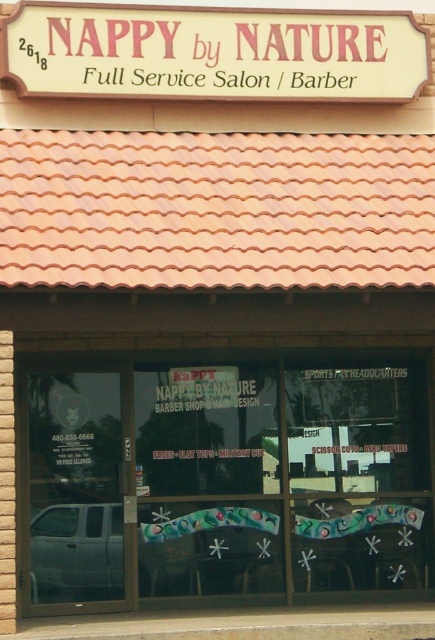
Does point (210, 529) come closer to viewer compared to point (101, 6)?

No, it is not.

What do you see at coordinates (236, 477) in the screenshot? This screenshot has width=435, height=640. I see `transparent glass window at center` at bounding box center [236, 477].

Image resolution: width=435 pixels, height=640 pixels. Identify the location of transparent glass window at center. (236, 477).

At what (x,y) coordinates should I click in order to perform the action: click on transparent glass window at center. Please return your answer as a coordinate pair (x, y). Image resolution: width=435 pixels, height=640 pixels. Looking at the image, I should click on (236, 477).